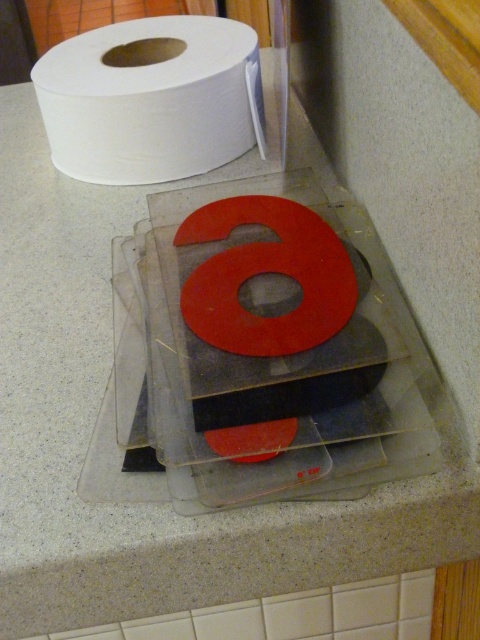
You are organizing items on a countertop and need to place a new item between the white matte paper towel at upper left and the matte red letter at center. What is the minimum distance you need to maintain between these two items to ensure the new item fits?

The minimum distance required is 13.69 inches, as the white matte paper towel at upper left and matte red letter at center are 13.69 inches apart. The new item must fit within this space.

You are a delivery person who just arrived at the kitchen counter. You need to place a small package on the countertop. The package must be placed exactly at the coordinates given for the white matte paper towel at upper left. Where should you place the package?

You should place the package exactly at the coordinates point (152,99) where the white matte paper towel at upper left is located.

You are standing in front of the countertop and need to place a new item exactly at point (x=152, y=99). Which object on the countertop is already at that location?

The white matte paper towel at upper left is located at point (x=152, y=99).